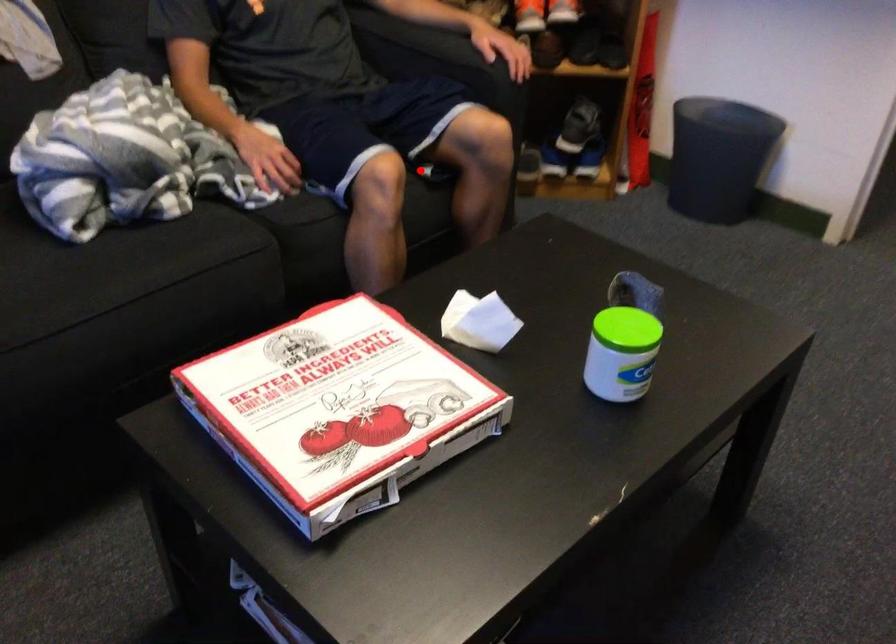
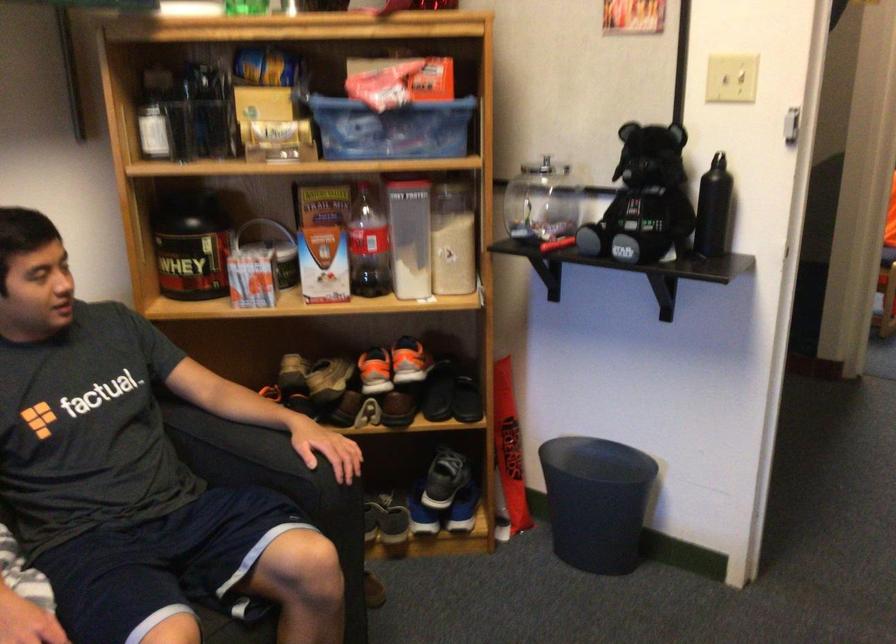
In the second image, find the point that corresponds to the highlighted location in the first image.

(237, 605)